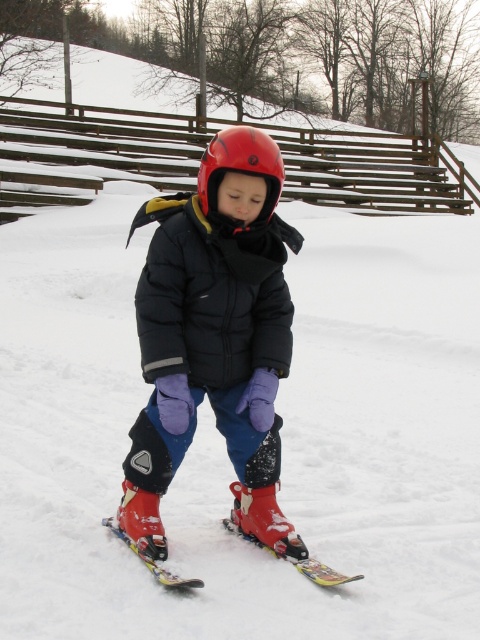
The scene shows a child on a snowy slope wearing two jackets. Which jacket, the matte black jacket at center or the black puffy jacket at center, is taller?

The matte black jacket at center is taller than the black puffy jacket at center according to the description.

You are a photographer trying to capture the child in the scene. Since the black puffy jacket at center and the shiny metallic skis at lower center are both in view, which object would appear bigger in your photo?

The black puffy jacket at center would appear bigger in the photo because it has a larger size compared to the shiny metallic skis at lower center.